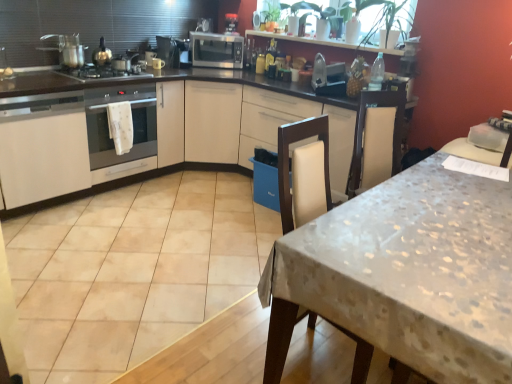
Measure the distance between metallic silver toaster at upper center, which is counted as the 3th appliance, starting from the top, and camera.

metallic silver toaster at upper center, which is counted as the 3th appliance, starting from the top, is 3.07 meters from camera.

Describe the element at coordinates (168, 51) in the screenshot. I see `satin black microwave at upper center, which is counted as the 2th appliance, starting from the front` at that location.

Where is `black plastic coffee machine at upper center`? This screenshot has width=512, height=384. black plastic coffee machine at upper center is located at coordinates (231, 24).

Describe the element at coordinates (216, 50) in the screenshot. I see `satin silver microwave at center, which is the second kitchen appliance from left to right` at that location.

What is the approximate width of metallic microwave at upper center, which ranks as the second appliance in right-to-left order?

The width of metallic microwave at upper center, which ranks as the second appliance in right-to-left order, is 6.75 inches.

The height and width of the screenshot is (384, 512). I want to click on green glossy plant at upper center, so click(x=385, y=21).

What are the coordinates of `metallic silver toaster at upper center, which is the first appliance from bottom to top` in the screenshot? It's located at click(x=328, y=77).

Considering the positions of objects white textured table at center and satin silver microwave at center, which is the first kitchen appliance from top to bottom, in the image provided, who is in front, white textured table at center or satin silver microwave at center, which is the first kitchen appliance from top to bottom,?

white textured table at center is more forward.

From the image's perspective, between white textured table at center and satin silver microwave at center, which is the second kitchen appliance from left to right, which one is located above?

satin silver microwave at center, which is the second kitchen appliance from left to right.

Who is bigger, white textured table at center or satin silver microwave at center, which is the first kitchen appliance from top to bottom?

Bigger between the two is white textured table at center.

Which is more to the left, white textured table at center or satin silver microwave at center, placed as the 1th kitchen appliance when sorted from right to left?

satin silver microwave at center, placed as the 1th kitchen appliance when sorted from right to left.

Would you say white textured table at center contains green glossy plant at upper center?

That's incorrect, green glossy plant at upper center is not inside white textured table at center.

From the image's perspective, is white textured table at center positioned above or below green glossy plant at upper center?

Based on their image positions, white textured table at center is located beneath green glossy plant at upper center.

Is white textured table at center not close to green glossy plant at upper center?

Yes.

Does white textured table at center have a smaller size compared to green glossy plant at upper center?

No.

Is metallic microwave at upper center, which ranks as the second appliance in right-to-left order, far away from satin silver microwave at center, acting as the first kitchen appliance starting from the back?

No.

Who is bigger, metallic microwave at upper center, which ranks as the 1th appliance in top-to-bottom order, or satin silver microwave at center, positioned as the 2th kitchen appliance in front-to-back order?

satin silver microwave at center, positioned as the 2th kitchen appliance in front-to-back order.

Is metallic microwave at upper center, which ranks as the 1th appliance in top-to-bottom order, shorter than satin silver microwave at center, which is the first kitchen appliance from top to bottom?

Indeed, metallic microwave at upper center, which ranks as the 1th appliance in top-to-bottom order, has a lesser height compared to satin silver microwave at center, which is the first kitchen appliance from top to bottom.

Considering the sizes of objects white glossy cabinet at left and satin silver microwave at center, positioned as the 2th kitchen appliance in front-to-back order, in the image provided, who is taller, white glossy cabinet at left or satin silver microwave at center, positioned as the 2th kitchen appliance in front-to-back order,?

white glossy cabinet at left is taller.

Does white glossy cabinet at left turn towards satin silver microwave at center, which is the first kitchen appliance from top to bottom?

No, white glossy cabinet at left is not turned towards satin silver microwave at center, which is the first kitchen appliance from top to bottom.

Between white glossy cabinet at left and satin silver microwave at center, placed as the 1th kitchen appliance when sorted from right to left, which one appears on the left side from the viewer's perspective?

white glossy cabinet at left.

From a real-world perspective, who is located lower, white glossy cabinet at left or satin silver microwave at center, acting as the first kitchen appliance starting from the back?

In real-world perspective, white glossy cabinet at left is lower.

From a real-world perspective, relative to black plastic coffee machine at upper center, is satin silver microwave at center vertically above or below?

satin silver microwave at center is situated lower than black plastic coffee machine at upper center in the real world.

Does satin silver microwave at center appear on the left side of black plastic coffee machine at upper center?

Yes.

Which of these two, satin silver microwave at center or black plastic coffee machine at upper center, is wider?

Wider between the two is satin silver microwave at center.

Is green glossy plant at upper center at the left side of black plastic coffee machine at upper center?

No.

Find the location of a particular element. This screenshot has height=384, width=512. coffee machine behind the green glossy plant at upper center is located at coordinates (231, 24).

How many degrees apart are the facing directions of green glossy plant at upper center and black plastic coffee machine at upper center?

green glossy plant at upper center and black plastic coffee machine at upper center are facing 54.5 degrees away from each other.

Is satin silver gas stove at left in front of or behind black plastic coffee machine at upper center in the image?

In the image, satin silver gas stove at left appears in front of black plastic coffee machine at upper center.

From a real-world perspective, who is located higher, satin silver gas stove at left or black plastic coffee machine at upper center?

From a 3D spatial view, black plastic coffee machine at upper center is above.

Based on their positions, is satin silver gas stove at left located to the left or right of black plastic coffee machine at upper center?

Clearly, satin silver gas stove at left is on the left of black plastic coffee machine at upper center in the image.

Which of these two, satin silver gas stove at left or black plastic coffee machine at upper center, is thinner?

black plastic coffee machine at upper center.

The height and width of the screenshot is (384, 512). I want to click on the 2nd kitchen appliance behind the white textured table at center, starting your count from the anchor, so click(216, 50).

Where is `table located on the left of green glossy plant at upper center`? This screenshot has width=512, height=384. table located on the left of green glossy plant at upper center is located at coordinates (406, 274).

From the picture: From the image, which object appears to be farther from satin silver gas stove at left, white glossy cabinet at left or shiny silver pot at upper left, positioned as the 2th kitchen appliance in top-to-bottom order?

white glossy cabinet at left is further to satin silver gas stove at left.

From the image, which object appears to be farther from shiny silver pot at upper left, which is the 2th kitchen appliance from back to front, metallic microwave at upper center, which is the third appliance from front to back, or satin silver microwave at center?

The object further to shiny silver pot at upper left, which is the 2th kitchen appliance from back to front, is metallic microwave at upper center, which is the third appliance from front to back.

Estimate the real-world distances between objects in this image. Which object is closer to white glossy cabinet at left, green glossy plant at upper center or metallic silver toaster at upper center, which is counted as the 3th appliance, starting from the top?

Among the two, metallic silver toaster at upper center, which is counted as the 3th appliance, starting from the top, is located nearer to white glossy cabinet at left.

Looking at the image, which one is located further to green glossy plant at upper center, satin silver microwave at center, acting as the first kitchen appliance starting from the back, or white textured table at center?

white textured table at center is positioned further to the anchor green glossy plant at upper center.

When comparing their distances from satin silver microwave at center, which is the 2th kitchen appliance in bottom-to-top order, does metallic silver toaster at upper center, marked as the third appliance in a back-to-front arrangement, or white textured table at center seem further?

Among the two, white textured table at center is located further to satin silver microwave at center, which is the 2th kitchen appliance in bottom-to-top order.

Looking at the image, which one is located further to satin silver microwave at center, placed as the 1th kitchen appliance when sorted from right to left, metallic silver toaster at upper center, the 3th appliance when ordered from left to right, or satin black microwave at upper center, which is counted as the 2th appliance, starting from the front?

metallic silver toaster at upper center, the 3th appliance when ordered from left to right.

From the image, which object appears to be farther from white glossy cabinet at left, white textured table at center or black plastic coffee machine at upper center?

Based on the image, white textured table at center appears to be further to white glossy cabinet at left.

Consider the image. When comparing their distances from shiny silver pot at upper left, which is counted as the first kitchen appliance, starting from the bottom, does white textured table at center or white glossy cabinet at left seem closer?

white glossy cabinet at left is closer to shiny silver pot at upper left, which is counted as the first kitchen appliance, starting from the bottom.

This screenshot has height=384, width=512. Identify the location of coffee machine between metallic microwave at upper center, marked as the first appliance in a back-to-front arrangement, and metallic silver toaster at upper center, marked as the third appliance in a back-to-front arrangement, in the horizontal direction. (231, 24).

This screenshot has width=512, height=384. I want to click on cabinetry positioned between white textured table at center and satin silver microwave at center, which is the first kitchen appliance from top to bottom, from near to far, so click(x=42, y=147).

Locate an element on the screen. The image size is (512, 384). kitchen appliance situated between white fabric towel at left and green glossy plant at upper center from left to right is located at coordinates (216, 50).

At what (x,y) coordinates should I click in order to perform the action: click on microwave oven between white textured table at center and black plastic coffee machine at upper center from front to back. Please return your answer as a coordinate pair (x, y). The image size is (512, 384). Looking at the image, I should click on (132, 120).